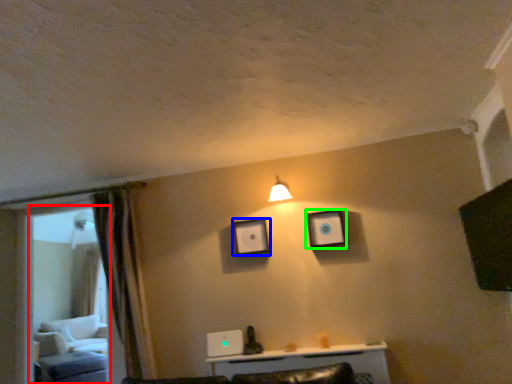
Question: Which is farther away from glass door (highlighted by a red box)? picture frame (highlighted by a blue box) or picture frame (highlighted by a green box)?

Choices:
 (A) picture frame
 (B) picture frame

Answer: (B)